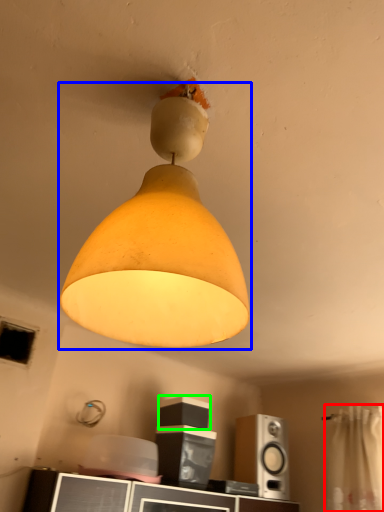
Question: Which is nearer to the curtain (highlighted by a red box)? lamp (highlighted by a blue box) or speaker (highlighted by a green box).

Choices:
 (A) lamp
 (B) speaker

Answer: (B)